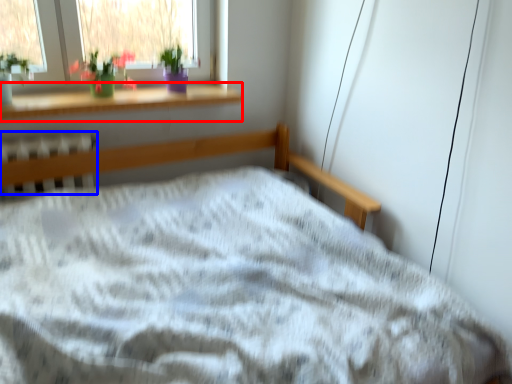
Question: Which object appears farthest to the camera in this image, window sill (highlighted by a red box) or radiator (highlighted by a blue box)?

Choices:
 (A) window sill
 (B) radiator

Answer: (A)